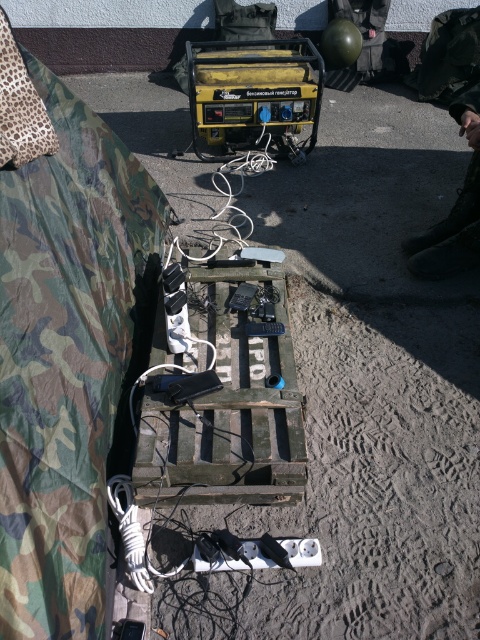
Question: Does yellow plastic generator at center appear on the right side of white cable at center?

Choices:
 (A) no
 (B) yes

Answer: (B)

Question: Is yellow plastic generator at center thinner than white cable at center?

Choices:
 (A) no
 (B) yes

Answer: (A)

Question: Which of the following is the closest to the observer?

Choices:
 (A) (231, 96)
 (B) (249, 157)

Answer: (A)

Question: Which point appears closest to the camera in this image?

Choices:
 (A) (305, 102)
 (B) (181, 253)

Answer: (B)

Question: Does yellow plastic generator at center have a smaller size compared to white cable at center?

Choices:
 (A) no
 (B) yes

Answer: (A)